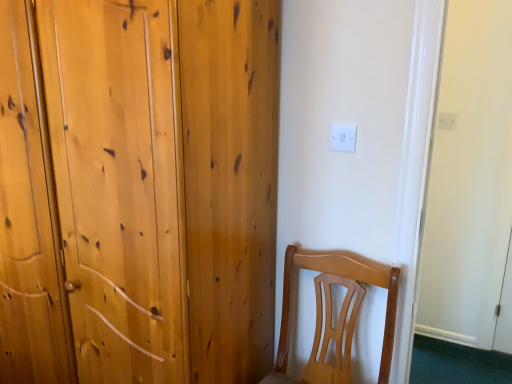
Question: Can you confirm if natural wood wardrobe at left is bigger than white plastic electric outlet at upper right, which appears as the 1th electric outlet when viewed from the top?

Choices:
 (A) no
 (B) yes

Answer: (B)

Question: Is natural wood wardrobe at left smaller than white plastic electric outlet at upper right, placed as the second electric outlet when sorted from bottom to top?

Choices:
 (A) yes
 (B) no

Answer: (B)

Question: From a real-world perspective, is natural wood wardrobe at left beneath white plastic electric outlet at upper right, which appears as the 1th electric outlet when viewed from the top?

Choices:
 (A) no
 (B) yes

Answer: (B)

Question: Is natural wood wardrobe at left shorter than white plastic electric outlet at upper right, which appears as the 1th electric outlet when viewed from the top?

Choices:
 (A) no
 (B) yes

Answer: (A)

Question: From the image's perspective, does natural wood wardrobe at left appear higher than white plastic electric outlet at upper right, which appears as the 1th electric outlet when viewed from the top?

Choices:
 (A) no
 (B) yes

Answer: (A)

Question: Relative to white plastic electric outlet at upper center, the 1th electric outlet when ordered from bottom to top, is white plastic electric outlet at upper right, the 2th electric outlet viewed from the left, in front or behind?

Choices:
 (A) front
 (B) behind

Answer: (B)

Question: Is white plastic electric outlet at upper right, which is the first electric outlet from back to front, to the left or to the right of white plastic electric outlet at upper center, the second electric outlet in the right-to-left sequence, in the image?

Choices:
 (A) right
 (B) left

Answer: (A)

Question: Does point (441, 114) appear closer or farther from the camera than point (333, 144)?

Choices:
 (A) closer
 (B) farther

Answer: (B)

Question: From a real-world perspective, is white plastic electric outlet at upper right, positioned as the second electric outlet in front-to-back order, above or below white plastic electric outlet at upper center, which appears as the 1th electric outlet when viewed from the left?

Choices:
 (A) above
 (B) below

Answer: (B)

Question: In terms of size, does white plastic electric outlet at upper right, the 2th electric outlet viewed from the left, appear bigger or smaller than natural wood wardrobe at left?

Choices:
 (A) big
 (B) small

Answer: (B)

Question: From a real-world perspective, relative to natural wood wardrobe at left, is white plastic electric outlet at upper right, placed as the second electric outlet when sorted from bottom to top, vertically above or below?

Choices:
 (A) above
 (B) below

Answer: (A)

Question: Considering the positions of white plastic electric outlet at upper right, positioned as the 1th electric outlet in right-to-left order, and natural wood wardrobe at left in the image, is white plastic electric outlet at upper right, positioned as the 1th electric outlet in right-to-left order, taller or shorter than natural wood wardrobe at left?

Choices:
 (A) short
 (B) tall

Answer: (A)

Question: From the image's perspective, is white plastic electric outlet at upper right, which appears as the 1th electric outlet when viewed from the top, above or below natural wood wardrobe at left?

Choices:
 (A) below
 (B) above

Answer: (B)

Question: From the image's perspective, relative to natural wood wardrobe at left, is white plastic electric outlet at upper center, arranged as the second electric outlet when viewed from the back, above or below?

Choices:
 (A) above
 (B) below

Answer: (A)

Question: From their relative heights in the image, would you say white plastic electric outlet at upper center, the second electric outlet in the right-to-left sequence, is taller or shorter than natural wood wardrobe at left?

Choices:
 (A) tall
 (B) short

Answer: (B)